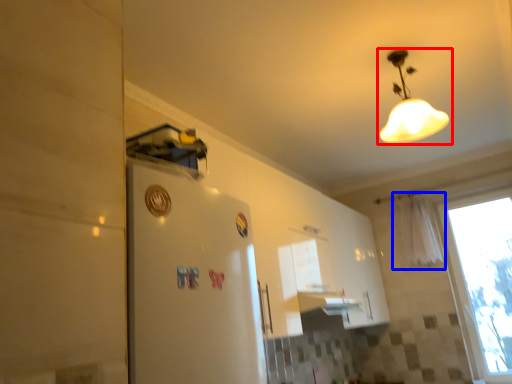
Question: Among these objects, which one is farthest to the camera, lamp (highlighted by a red box) or curtain (highlighted by a blue box)?

Choices:
 (A) lamp
 (B) curtain

Answer: (B)